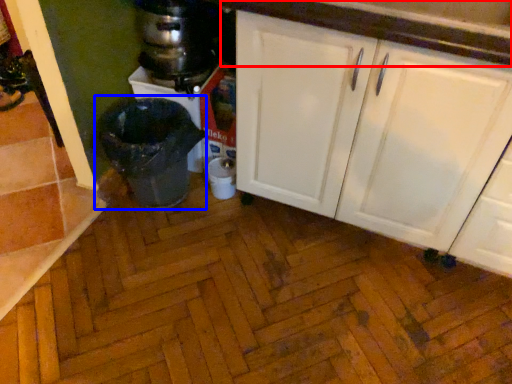
Question: Which object is further to the camera taking this photo, countertop (highlighted by a red box) or waste container (highlighted by a blue box)?

Choices:
 (A) countertop
 (B) waste container

Answer: (B)